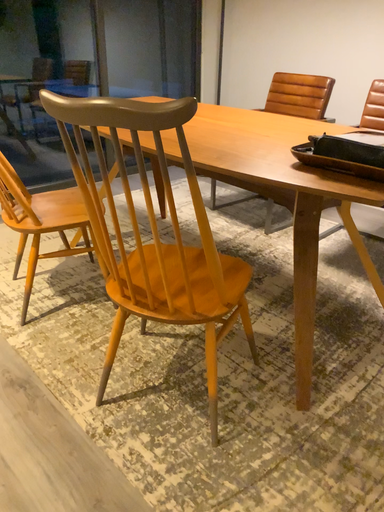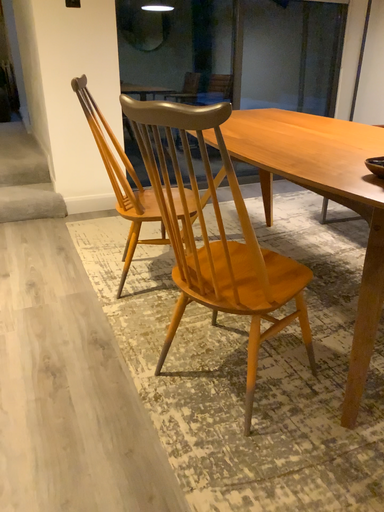
Question: How did the camera likely rotate when shooting the video?

Choices:
 (A) rotated right
 (B) rotated left

Answer: (B)